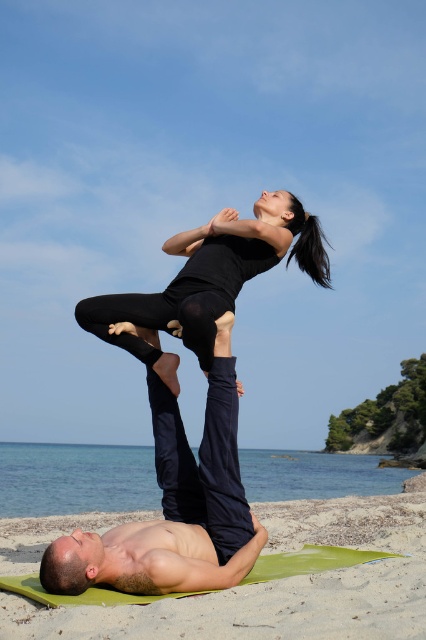
Is smooth black pants at center bigger than black matte yoga pants at upper center?

Indeed, smooth black pants at center has a larger size compared to black matte yoga pants at upper center.

Between point (164, 538) and point (258, 259), which one is positioned in front?

Point (164, 538) is in front.

Which is behind, point (169, 426) or point (198, 273)?

Positioned behind is point (169, 426).

At what (x,y) coordinates should I click in order to perform the action: click on smooth black pants at center. Please return your answer as a coordinate pair (x, y). Looking at the image, I should click on click(x=175, y=506).

Does sandy beach at lower center appear on the left side of black matte yoga pants at upper center?

Indeed, sandy beach at lower center is positioned on the left side of black matte yoga pants at upper center.

Is sandy beach at lower center closer to the viewer compared to black matte yoga pants at upper center?

Yes, it is in front of black matte yoga pants at upper center.

Does point (252, 609) come closer to viewer compared to point (167, 374)?

Yes, it is in front of point (167, 374).

Image resolution: width=426 pixels, height=640 pixels. I want to click on sandy beach at lower center, so click(276, 586).

In the scene shown: Does sandy beach at lower center have a greater width compared to smooth black pants at center?

Yes.

Between sandy beach at lower center and smooth black pants at center, which one is positioned higher?

smooth black pants at center is above.

Is point (273, 609) positioned after point (68, 573)?

No.

You are a GUI agent. You are given a task and a screenshot of the screen. Output one action in this format:
    pyautogui.click(x=<x>, y=<y>)
    Task: Click on the sandy beach at lower center
    Image resolution: width=426 pixels, height=640 pixels.
    Given the screenshot: What is the action you would take?
    pyautogui.click(x=276, y=586)